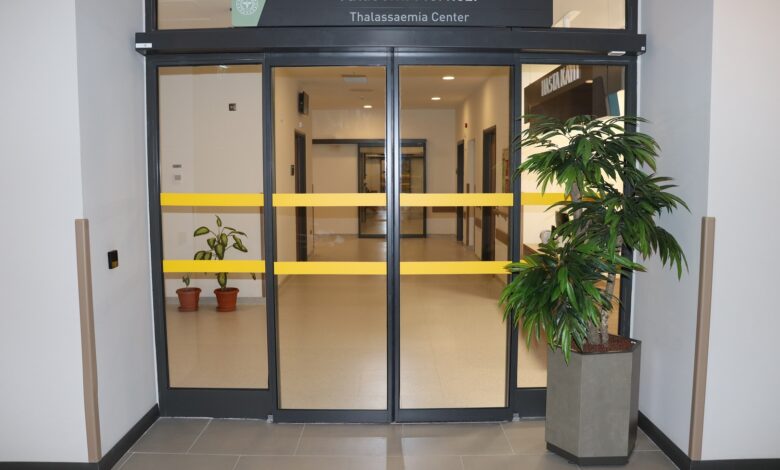
Where is `floor`? Image resolution: width=780 pixels, height=470 pixels. floor is located at coordinates (445, 312).